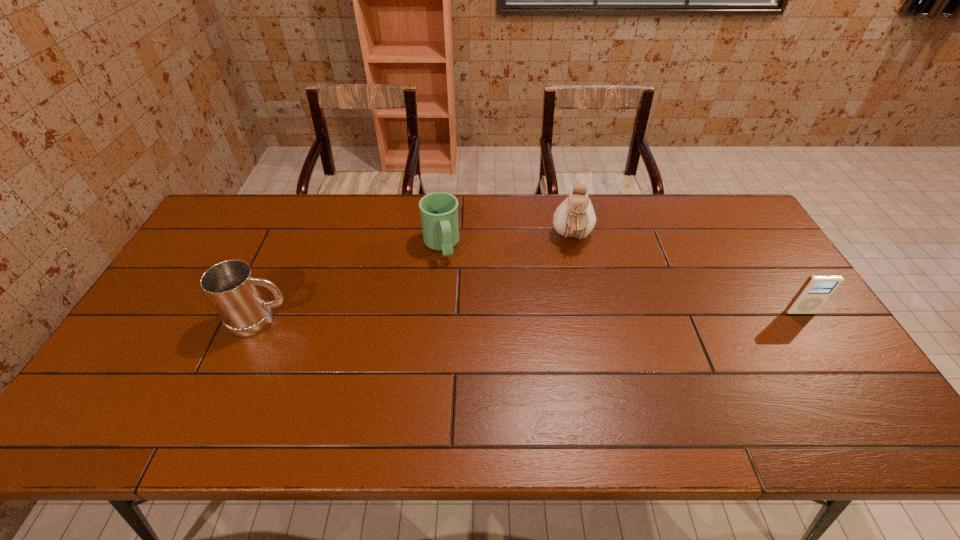
Locate an element on the screen. Image resolution: width=960 pixels, height=540 pixels. vacant space that is in between the left mug and the iPod is located at coordinates (531, 316).

This screenshot has height=540, width=960. Find the location of `free space between the third object from left to right and the nearer mug`. free space between the third object from left to right and the nearer mug is located at coordinates (417, 279).

Locate which object is the closest to the pouch. Please provide its 2D coordinates. Your answer should be formatted as a tuple, i.e. [(x, y)], where the tuple contains the x and y coordinates of a point satisfying the conditions above.

[(439, 210)]

Locate which object ranks in proximity to the left mug. Please provide its 2D coordinates. Your answer should be formatted as a tuple, i.e. [(x, y)], where the tuple contains the x and y coordinates of a point satisfying the conditions above.

[(439, 210)]